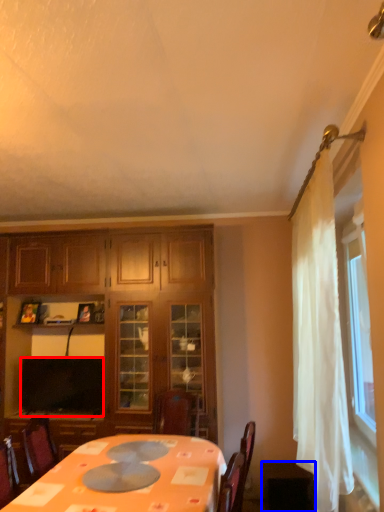
Question: Which object is closer to the camera taking this photo, television (highlighted by a red box) or table (highlighted by a blue box)?

Choices:
 (A) television
 (B) table

Answer: (B)